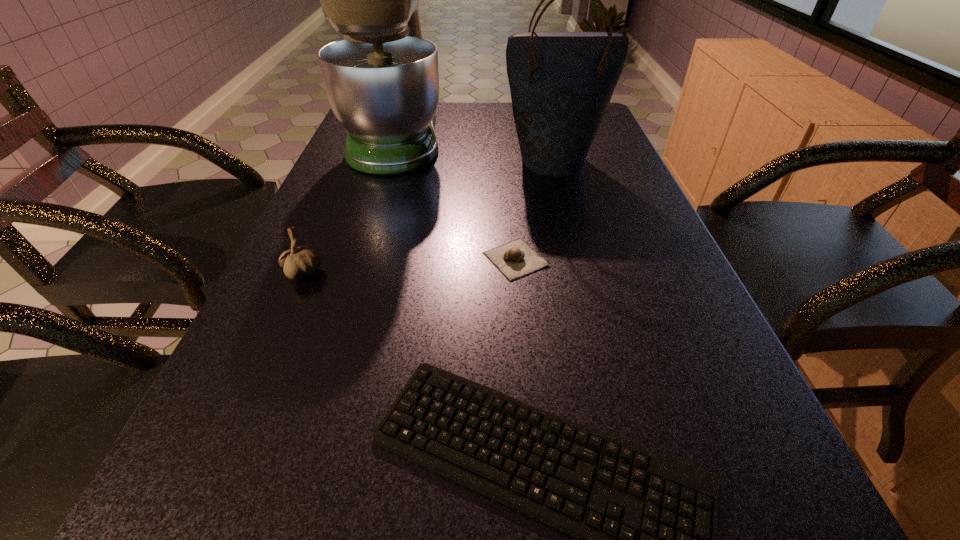
You are a GUI agent. You are given a task and a screenshot of the screen. Output one action in this format:
    pyautogui.click(x=<x>, y=<y>)
    Task: Click on the mixer
    
    Given the screenshot: What is the action you would take?
    pyautogui.click(x=382, y=81)

Where is `the second tallest object`? the second tallest object is located at coordinates (561, 83).

Identify the location of the taller garlic. The width and height of the screenshot is (960, 540). (298, 262).

The height and width of the screenshot is (540, 960). What are the coordinates of `the left garlic` in the screenshot? It's located at (298, 262).

You are a GUI agent. You are given a task and a screenshot of the screen. Output one action in this format:
    pyautogui.click(x=<x>, y=<y>)
    Task: Click on the right garlic
    
    Given the screenshot: What is the action you would take?
    pyautogui.click(x=515, y=259)

The image size is (960, 540). I want to click on the shorter garlic, so click(x=515, y=259).

I want to click on free spot located on the controls of the mixer, so click(x=532, y=138).

What are the coordinates of `free space located 0.230m on the left of the second tallest object` in the screenshot? It's located at (416, 160).

Identify the location of vacant space positioned 0.050m on the back of the left garlic. [315, 245].

Where is `vacant space situated on the left of the right garlic`? vacant space situated on the left of the right garlic is located at coordinates (446, 259).